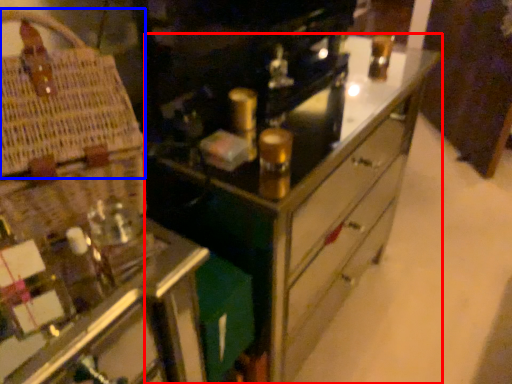
Question: Which of the following is the closest to the observer, chest of drawers (highlighted by a red box) or basket (highlighted by a blue box)?

Choices:
 (A) chest of drawers
 (B) basket

Answer: (B)